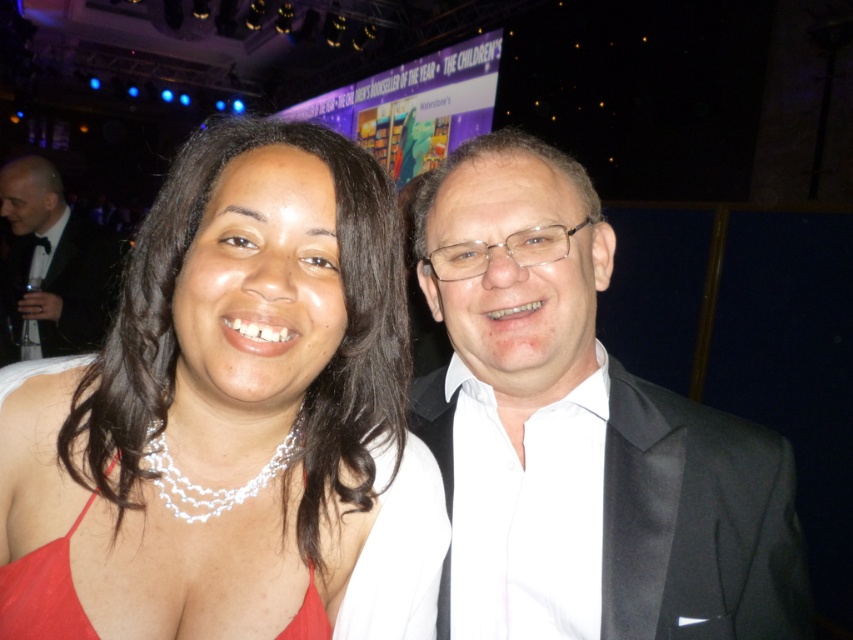
Question: Is black satin suit at right to the left of black tuxedo at left from the viewer's perspective?

Choices:
 (A) yes
 (B) no

Answer: (B)

Question: Is black satin suit at right smaller than red satin dress at center?

Choices:
 (A) no
 (B) yes

Answer: (A)

Question: Which point appears farthest from the camera in this image?

Choices:
 (A) (270, 602)
 (B) (67, 275)

Answer: (B)

Question: Considering the relative positions of black satin suit at right and red satin dress at center in the image provided, where is black satin suit at right located with respect to red satin dress at center?

Choices:
 (A) right
 (B) left

Answer: (A)

Question: Among these objects, which one is nearest to the camera?

Choices:
 (A) red satin dress at center
 (B) matte red dress at center
 (C) black satin suit at right

Answer: (B)

Question: Which point is farther to the camera?

Choices:
 (A) black satin suit at right
 (B) black tuxedo at left

Answer: (B)